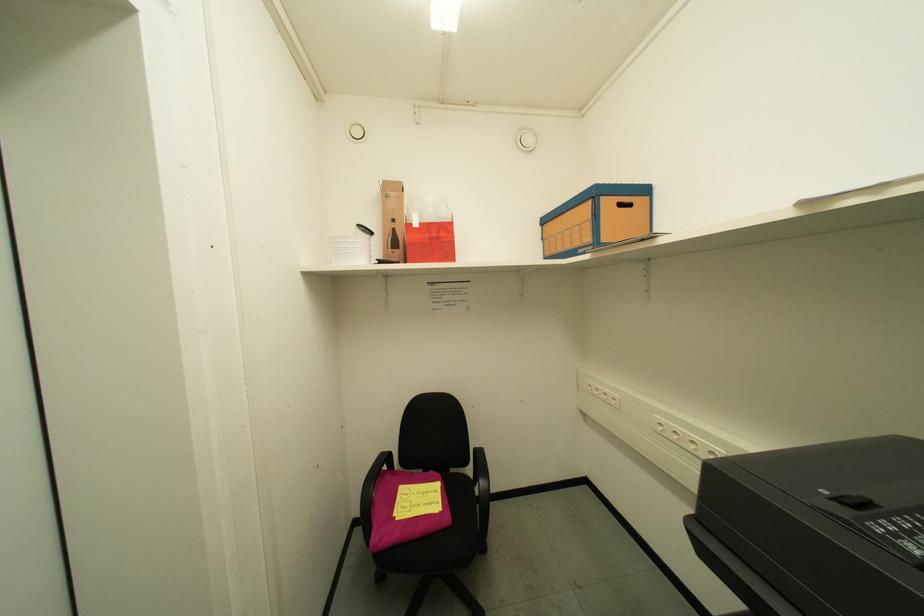
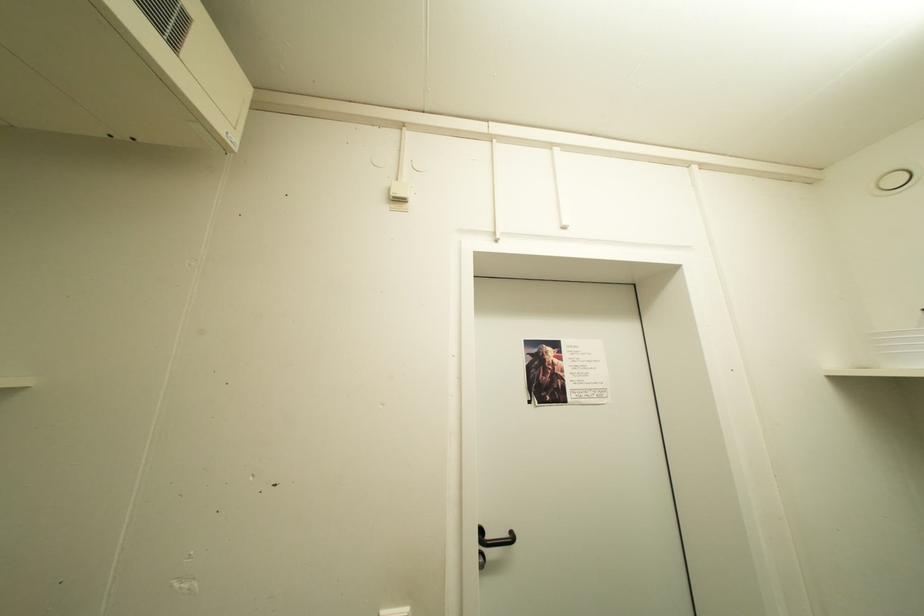
Question: Based on the continuous images, in which direction is the camera rotating? Reply with the corresponding letter.

Choices:
 (A) Left
 (B) Right
 (C) Up
 (D) Down

Answer: (A)